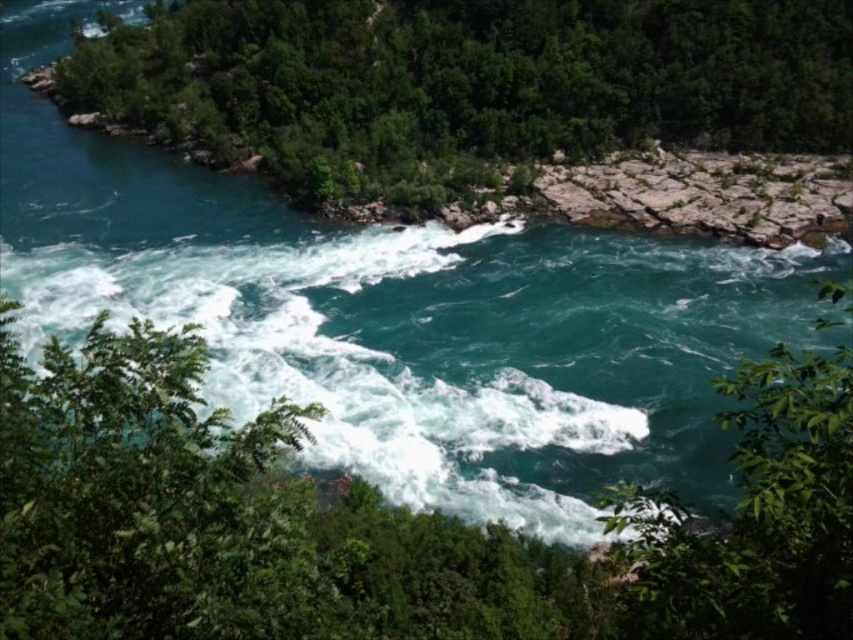
Between green leafy tree at upper left and green leafy tree at center, which one has more height?

green leafy tree at upper left

Is point (534, 56) more distant than point (758, 392)?

That is True.

The image size is (853, 640). I want to click on green leafy tree at upper left, so click(463, 84).